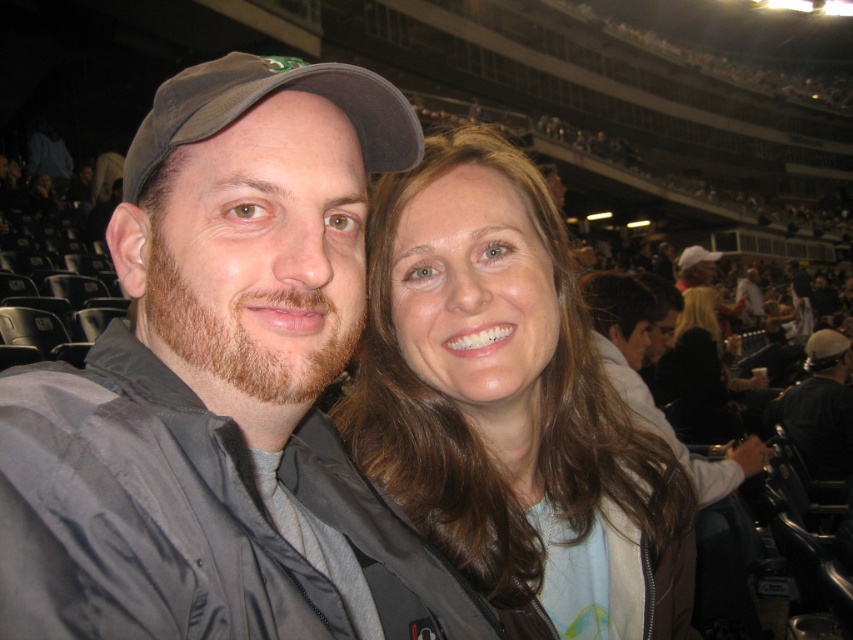
You are a photographer standing in front of the matte gray jacket at center. You want to take a closeup shot of it but need to ensure you are within the recommended 24 inches distance for optimal focus. Are you currently within the required distance?

The matte gray jacket at center is 23.40 inches from viewer, which is within the recommended 24 inches distance for optimal focus. You can take the closeup shot now.

You are a photographer standing in the stadium and want to capture a closeup of the smooth brown hair at center and the black leather jacket at lower right. Which object should you zoom in on first if you want to focus on the wider one?

The smooth brown hair at center is wider than the black leather jacket at lower right, so you should zoom in on the smooth brown hair at center first.